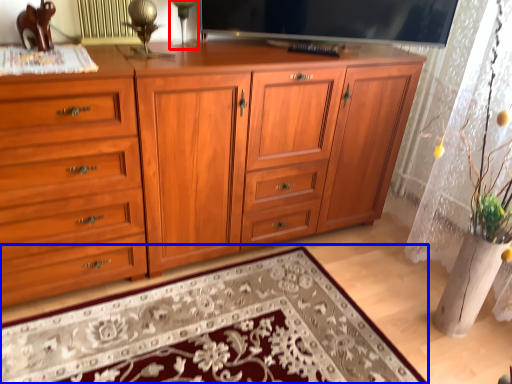
Question: Which object appears closest to the camera in this image, table lamp (highlighted by a red box) or mat (highlighted by a blue box)?

Choices:
 (A) table lamp
 (B) mat

Answer: (B)